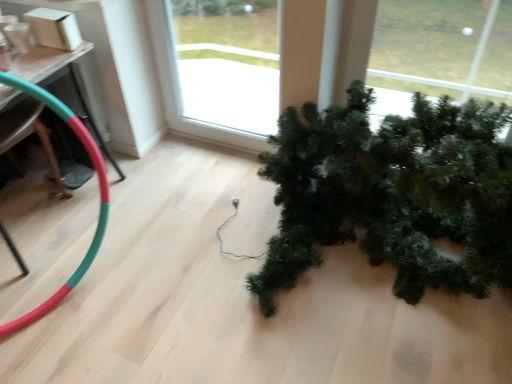
Question: Is transparent glass window at center shorter than green matte christmas tree at lower right?

Choices:
 (A) yes
 (B) no

Answer: (B)

Question: Considering the relative sizes of transparent glass window at center and green matte christmas tree at lower right in the image provided, is transparent glass window at center thinner than green matte christmas tree at lower right?

Choices:
 (A) no
 (B) yes

Answer: (B)

Question: Does transparent glass window at center come in front of green matte christmas tree at lower right?

Choices:
 (A) no
 (B) yes

Answer: (A)

Question: Is transparent glass window at center to the right of green matte christmas tree at lower right from the viewer's perspective?

Choices:
 (A) no
 (B) yes

Answer: (A)

Question: Considering the relative sizes of transparent glass window at center and green matte christmas tree at lower right in the image provided, is transparent glass window at center wider than green matte christmas tree at lower right?

Choices:
 (A) yes
 (B) no

Answer: (B)

Question: Is green matte christmas tree at lower right taller or shorter than transparent glass window at center?

Choices:
 (A) short
 (B) tall

Answer: (A)

Question: Is green matte christmas tree at lower right wider or thinner than transparent glass window at center?

Choices:
 (A) thin
 (B) wide

Answer: (B)

Question: From the image's perspective, is green matte christmas tree at lower right positioned above or below transparent glass window at center?

Choices:
 (A) above
 (B) below

Answer: (B)

Question: In terms of size, does green matte christmas tree at lower right appear bigger or smaller than transparent glass window at center?

Choices:
 (A) small
 (B) big

Answer: (B)

Question: Do you think transparent glass window at center is within green matte christmas tree at lower right, or outside of it?

Choices:
 (A) inside
 (B) outside

Answer: (B)

Question: From a real-world perspective, is transparent glass window at center physically located above or below green matte christmas tree at lower right?

Choices:
 (A) above
 (B) below

Answer: (A)

Question: Looking at the image, does transparent glass window at center seem bigger or smaller compared to green matte christmas tree at lower right?

Choices:
 (A) small
 (B) big

Answer: (A)

Question: In the image, is transparent glass window at center positioned in front of or behind green matte christmas tree at lower right?

Choices:
 (A) behind
 (B) front

Answer: (A)

Question: Choose the correct answer: Is rubber green and red garden hose at lower left inside green matte christmas tree at lower right or outside it?

Choices:
 (A) outside
 (B) inside

Answer: (A)

Question: Considering the positions of rubber green and red garden hose at lower left and green matte christmas tree at lower right in the image, is rubber green and red garden hose at lower left taller or shorter than green matte christmas tree at lower right?

Choices:
 (A) short
 (B) tall

Answer: (A)